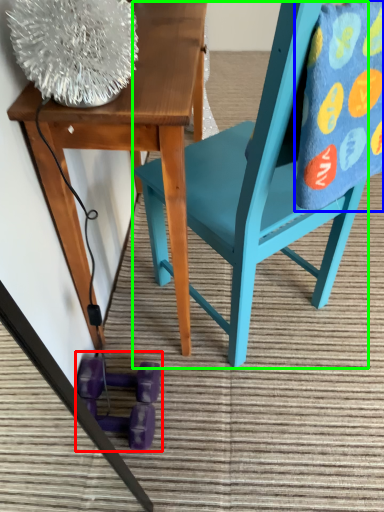
Question: Which object is the farthest from toy (highlighted by a red box)? Choose among these: blanket (highlighted by a blue box) or chair (highlighted by a green box).

Choices:
 (A) blanket
 (B) chair

Answer: (A)